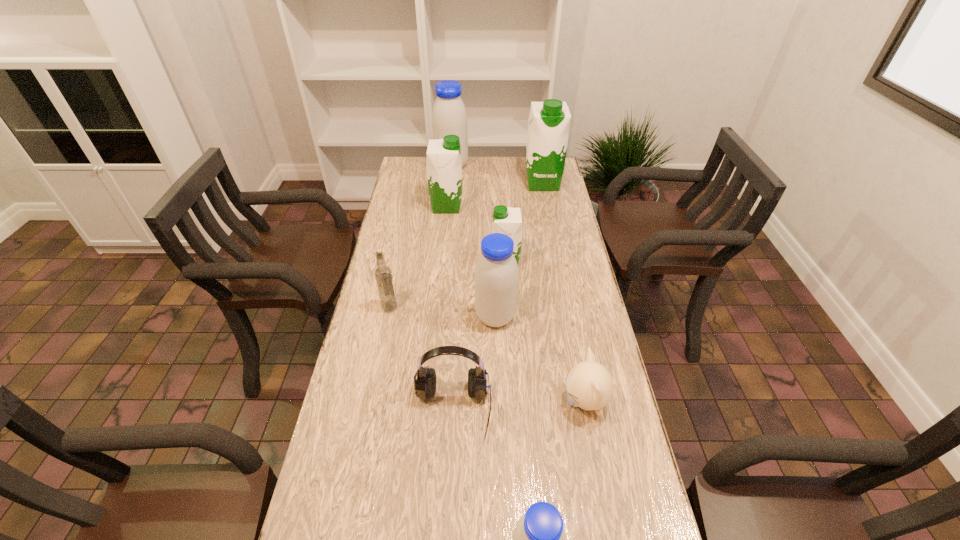
This screenshot has height=540, width=960. In order to click on free space located on the front-facing side of the third nearest soya milk in this screenshot , I will do `click(449, 262)`.

At what (x,y) coordinates should I click in order to perform the action: click on blank space located on the ear cushions of the second shortest object. Please return your answer as a coordinate pair (x, y). The width and height of the screenshot is (960, 540). Looking at the image, I should click on (446, 536).

This screenshot has height=540, width=960. Find the location of `free space located 0.300m on the face of the kitten`. free space located 0.300m on the face of the kitten is located at coordinates (448, 402).

This screenshot has width=960, height=540. I want to click on vacant space located 0.280m on the face of the kitten, so click(456, 402).

You are a GUI agent. You are given a task and a screenshot of the screen. Output one action in this format:
    pyautogui.click(x=<x>, y=<y>)
    Task: Click on the free location located on the face of the kitten
    
    Given the screenshot: What is the action you would take?
    pyautogui.click(x=444, y=402)

You are a GUI agent. You are given a task and a screenshot of the screen. Output one action in this format:
    pyautogui.click(x=<x>, y=<y>)
    Task: Click on the vodka located at the left edge
    The height and width of the screenshot is (540, 960).
    Given the screenshot: What is the action you would take?
    pyautogui.click(x=383, y=274)

The image size is (960, 540). Find the location of `soya milk present at the right edge`. soya milk present at the right edge is located at coordinates (549, 122).

Identify the location of kitten at the right edge. (589, 385).

The height and width of the screenshot is (540, 960). What are the coordinates of `object present at the far left corner` in the screenshot? It's located at (449, 117).

Where is `object located in the far right corner section of the desktop`? object located in the far right corner section of the desktop is located at coordinates (549, 122).